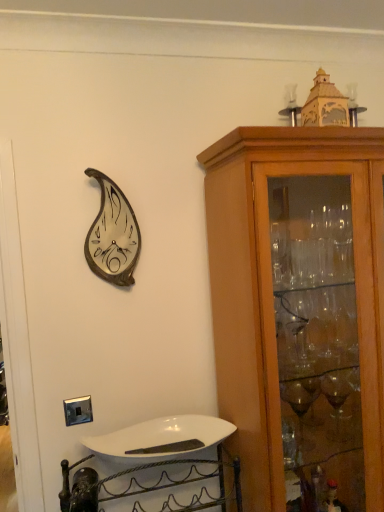
Question: Should I look upward or downward to see white glossy sink at lower center?

Choices:
 (A) up
 (B) down

Answer: (B)

Question: Considering the relative sizes of light brown wood cabinet at right and white glossy sink at lower center in the image provided, is light brown wood cabinet at right bigger than white glossy sink at lower center?

Choices:
 (A) yes
 (B) no

Answer: (A)

Question: Is light brown wood cabinet at right oriented away from white glossy sink at lower center?

Choices:
 (A) no
 (B) yes

Answer: (A)

Question: Is light brown wood cabinet at right thinner than white glossy sink at lower center?

Choices:
 (A) yes
 (B) no

Answer: (B)

Question: Is light brown wood cabinet at right to the left of white glossy sink at lower center from the viewer's perspective?

Choices:
 (A) yes
 (B) no

Answer: (B)

Question: Can you confirm if light brown wood cabinet at right is taller than white glossy sink at lower center?

Choices:
 (A) no
 (B) yes

Answer: (B)

Question: From a real-world perspective, is light brown wood cabinet at right physically below white glossy sink at lower center?

Choices:
 (A) no
 (B) yes

Answer: (A)

Question: Is white glossy sink at lower center taller than metallic silver clock at upper left?

Choices:
 (A) no
 (B) yes

Answer: (A)

Question: From a real-world perspective, is white glossy sink at lower center located higher than metallic silver clock at upper left?

Choices:
 (A) no
 (B) yes

Answer: (A)

Question: Is white glossy sink at lower center positioned before metallic silver clock at upper left?

Choices:
 (A) yes
 (B) no

Answer: (A)

Question: Is white glossy sink at lower center positioned behind metallic silver clock at upper left?

Choices:
 (A) yes
 (B) no

Answer: (B)

Question: Is white glossy sink at lower center wider than metallic silver clock at upper left?

Choices:
 (A) no
 (B) yes

Answer: (B)

Question: Is white glossy sink at lower center positioned with its back to metallic silver clock at upper left?

Choices:
 (A) no
 (B) yes

Answer: (A)

Question: From a real-world perspective, is light brown wood cabinet at right beneath metallic silver clock at upper left?

Choices:
 (A) no
 (B) yes

Answer: (B)